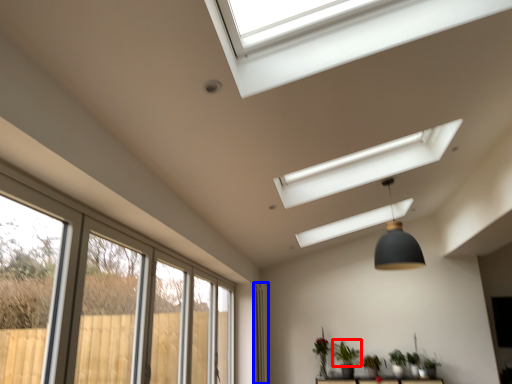
Question: Which of the following is the closest to the observer, plant (highlighted by a red box) or curtain (highlighted by a blue box)?

Choices:
 (A) plant
 (B) curtain

Answer: (A)